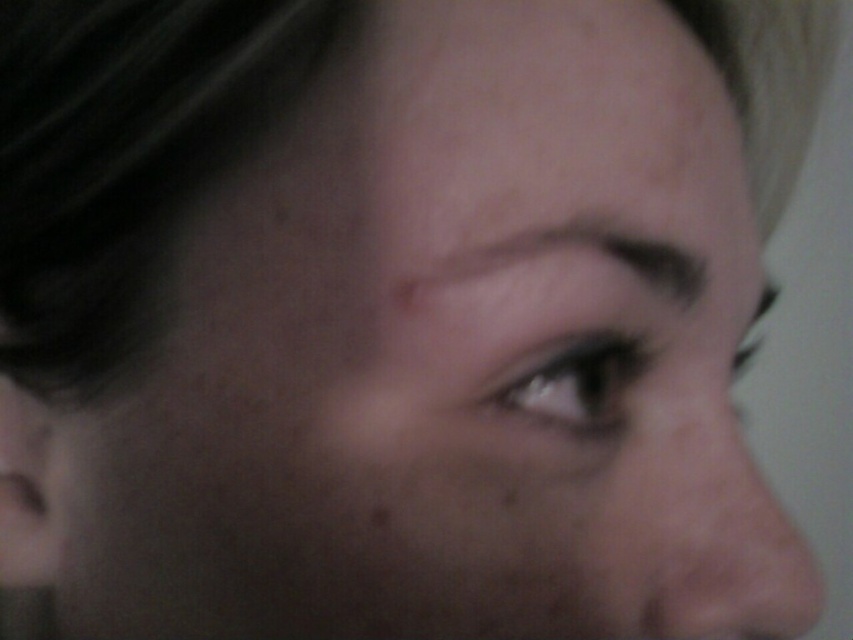
Question: Which point is closer to the camera taking this photo?

Choices:
 (A) (660, 278)
 (B) (662, 513)
 (C) (552, 392)

Answer: (B)

Question: Does pink smooth skin at lower right appear under smokey gray eye at center?

Choices:
 (A) yes
 (B) no

Answer: (A)

Question: Which point is closer to the camera taking this photo?

Choices:
 (A) (535, 248)
 (B) (561, 369)

Answer: (A)

Question: Does dark brown eyebrow at upper center have a greater width compared to smokey gray eye at center?

Choices:
 (A) yes
 (B) no

Answer: (A)

Question: Which of the following is the closest to the observer?

Choices:
 (A) (527, 356)
 (B) (656, 282)
 (C) (734, 436)

Answer: (A)

Question: In this image, where is dark brown eyebrow at upper center located relative to smokey gray eye at center?

Choices:
 (A) right
 (B) left

Answer: (B)